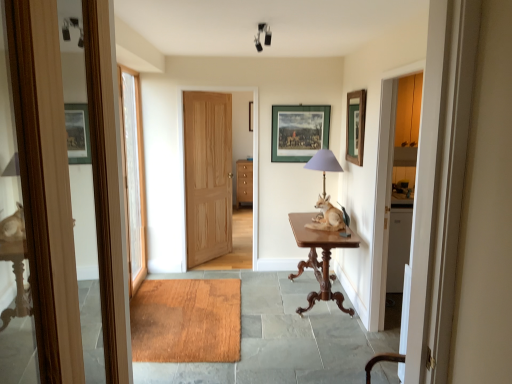
Locate an element on the screen. free point above wooden mat at center (from a real-world perspective) is located at coordinates 228,318.